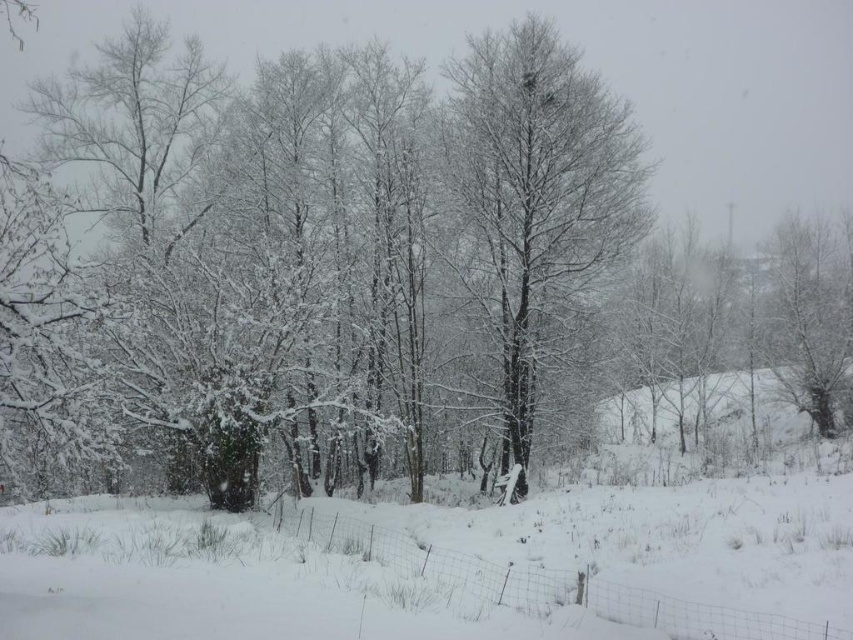
Between white fluffy snow at center and snow-covered tree at center, which one is positioned higher?

Positioned higher is snow-covered tree at center.

Does point (699, 524) lie in front of point (563, 189)?

Yes, it is in front of point (563, 189).

Where is `white fluffy snow at center`? The width and height of the screenshot is (853, 640). white fluffy snow at center is located at coordinates (444, 564).

Locate an element on the screen. This screenshot has width=853, height=640. white fluffy snow at center is located at coordinates click(x=444, y=564).